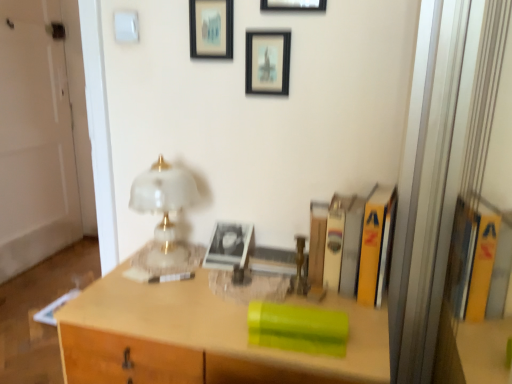
This screenshot has height=384, width=512. Find the location of `hardcover book at center, the second book positioned from the left`. hardcover book at center, the second book positioned from the left is located at coordinates (335, 240).

How much space does wooden picture frame at upper center, which is counted as the first picture frame, starting from the right, occupy horizontally?

The width of wooden picture frame at upper center, which is counted as the first picture frame, starting from the right, is 2.89 centimeters.

You are a GUI agent. You are given a task and a screenshot of the screen. Output one action in this format:
    pyautogui.click(x=<x>, y=<y>)
    Task: Click on the matte black picture frame at upper center, the 1th picture frame in the left-to-right sequence
    The height and width of the screenshot is (384, 512).
    Given the screenshot: What is the action you would take?
    pyautogui.click(x=211, y=29)

What do you see at coordinates (164, 208) in the screenshot? I see `matte glass table lamp at center` at bounding box center [164, 208].

The height and width of the screenshot is (384, 512). Find the location of `green plastic container at center, marked as the 3th book in a right-to-left arrangement`. green plastic container at center, marked as the 3th book in a right-to-left arrangement is located at coordinates (298, 328).

Can you confirm if hardcover book at center, the 2th book in the right-to-left sequence, is shorter than matte black picture frame at upper center, the 2th picture frame in the right-to-left sequence?

In fact, hardcover book at center, the 2th book in the right-to-left sequence, may be taller than matte black picture frame at upper center, the 2th picture frame in the right-to-left sequence.

Is hardcover book at center, the 2th book in the right-to-left sequence, aimed at matte black picture frame at upper center, the second picture frame viewed from the left?

No, hardcover book at center, the 2th book in the right-to-left sequence, is not aimed at matte black picture frame at upper center, the second picture frame viewed from the left.

Does hardcover book at center, the 2th book in the right-to-left sequence, have a smaller size compared to matte black picture frame at upper center, the second picture frame viewed from the left?

Actually, hardcover book at center, the 2th book in the right-to-left sequence, might be larger than matte black picture frame at upper center, the second picture frame viewed from the left.

Is point (338, 248) more distant than point (276, 91)?

That is False.

Considering the relative sizes of matte black picture frame at upper center, the 1th picture frame in the left-to-right sequence, and green plastic container at center, marked as the 3th book in a right-to-left arrangement, in the image provided, is matte black picture frame at upper center, the 1th picture frame in the left-to-right sequence, shorter than green plastic container at center, marked as the 3th book in a right-to-left arrangement,?

In fact, matte black picture frame at upper center, the 1th picture frame in the left-to-right sequence, may be taller than green plastic container at center, marked as the 3th book in a right-to-left arrangement.

Would you consider matte black picture frame at upper center, which is counted as the 3th picture frame, starting from the right, to be distant from green plastic container at center, marked as the 3th book in a right-to-left arrangement?

No, matte black picture frame at upper center, which is counted as the 3th picture frame, starting from the right, is in close proximity to green plastic container at center, marked as the 3th book in a right-to-left arrangement.

Is matte black picture frame at upper center, which is counted as the 3th picture frame, starting from the right, to the left or to the right of green plastic container at center, positioned as the first book in left-to-right order, in the image?

matte black picture frame at upper center, which is counted as the 3th picture frame, starting from the right, is positioned on green plastic container at center, positioned as the first book in left-to-right order,'s left side.

Who is shorter, wooden picture frame at upper center, which appears as the 3th picture frame when viewed from the left, or green plastic container at center?

Standing shorter between the two is wooden picture frame at upper center, which appears as the 3th picture frame when viewed from the left.

Which object is closer to the camera taking this photo, wooden picture frame at upper center, which is counted as the first picture frame, starting from the right, or green plastic container at center?

green plastic container at center is in front.

Locate an element on the screen. The height and width of the screenshot is (384, 512). picture frame that is the 2nd object to the right of the green plastic container at center, starting at the anchor is located at coordinates (294, 5).

Are wooden picture frame at upper center, which appears as the 3th picture frame when viewed from the left, and green plastic container at center beside each other?

wooden picture frame at upper center, which appears as the 3th picture frame when viewed from the left, and green plastic container at center are clearly separated.

Is point (246, 45) positioned before point (257, 303)?

No, (246, 45) is further to viewer.

Could you measure the distance between matte black picture frame at upper center, the second picture frame viewed from the left, and green plastic container at center, marked as the 3th book in a right-to-left arrangement?

matte black picture frame at upper center, the second picture frame viewed from the left, is 26.49 inches from green plastic container at center, marked as the 3th book in a right-to-left arrangement.

Considering the relative positions of matte black picture frame at upper center, the 2th picture frame in the right-to-left sequence, and green plastic container at center, marked as the 3th book in a right-to-left arrangement, in the image provided, is matte black picture frame at upper center, the 2th picture frame in the right-to-left sequence, in front of green plastic container at center, marked as the 3th book in a right-to-left arrangement,?

No.

Identify the location of the 2nd picture frame behind the green plastic container at center, positioned as the first book in left-to-right order. (267, 62).

Identify the location of desk below the matte glass table lamp at center (from a real-world perspective). (199, 338).

Does green plastic container at center have a greater width compared to matte glass table lamp at center?

Yes.

From the image's perspective, which one is positioned lower, green plastic container at center or matte glass table lamp at center?

green plastic container at center.

Can yellow hardcover book at right, positioned as the first book in right-to-left order, be found inside wooden picture frame at upper center, which appears as the 3th picture frame when viewed from the left?

Actually, yellow hardcover book at right, positioned as the first book in right-to-left order, is outside wooden picture frame at upper center, which appears as the 3th picture frame when viewed from the left.

Considering their positions, is wooden picture frame at upper center, which appears as the 3th picture frame when viewed from the left, located in front of or behind yellow hardcover book at right, which is counted as the 3th book, starting from the left?

wooden picture frame at upper center, which appears as the 3th picture frame when viewed from the left, is behind yellow hardcover book at right, which is counted as the 3th book, starting from the left.

How many degrees apart are the facing directions of wooden picture frame at upper center, which is counted as the first picture frame, starting from the right, and yellow hardcover book at right, which is counted as the 3th book, starting from the left?

wooden picture frame at upper center, which is counted as the first picture frame, starting from the right, and yellow hardcover book at right, which is counted as the 3th book, starting from the left, are facing 7.82 degrees away from each other.

Is wooden picture frame at upper center, which appears as the 3th picture frame when viewed from the left, not near yellow hardcover book at right, which is counted as the 3th book, starting from the left?

No, there isn't a large distance between wooden picture frame at upper center, which appears as the 3th picture frame when viewed from the left, and yellow hardcover book at right, which is counted as the 3th book, starting from the left.

This screenshot has height=384, width=512. I want to click on book that is the 1st one when counting forward from the matte black picture frame at upper center, the 2th picture frame in the right-to-left sequence, so click(335, 240).

From a real-world perspective, is matte black picture frame at upper center, the second picture frame viewed from the left, on hardcover book at center, the 2th book in the right-to-left sequence?

Correct, in the physical world, matte black picture frame at upper center, the second picture frame viewed from the left, is higher than hardcover book at center, the 2th book in the right-to-left sequence.

How many degrees apart are the facing directions of matte black picture frame at upper center, the 2th picture frame in the right-to-left sequence, and hardcover book at center, the second book positioned from the left?

The angular difference between matte black picture frame at upper center, the 2th picture frame in the right-to-left sequence, and hardcover book at center, the second book positioned from the left, is 3.73 degrees.

In the scene shown: Is matte black picture frame at upper center, the second picture frame viewed from the left, not close to hardcover book at center, the second book positioned from the left?

No, matte black picture frame at upper center, the second picture frame viewed from the left, is not far from hardcover book at center, the second book positioned from the left.

There is a hardcover book at center, the second book positioned from the left. What are the coordinates of `the 1st picture frame above it (from the image's perspective)` in the screenshot? It's located at (267, 62).

The image size is (512, 384). Identify the location of the 2nd picture frame to the left of the green plastic container at center, positioned as the first book in left-to-right order, starting your count from the anchor. (211, 29).

Which object lies nearer to the anchor point green plastic container at center, wooden picture frame at upper center, which appears as the 3th picture frame when viewed from the left, or matte black picture frame at upper center, the second picture frame viewed from the left?

Based on the image, matte black picture frame at upper center, the second picture frame viewed from the left, appears to be nearer to green plastic container at center.

When comparing their distances from hardcover book at center, the second book positioned from the left, does matte black picture frame at upper center, the second picture frame viewed from the left, or matte glass table lamp at center seem closer?

matte black picture frame at upper center, the second picture frame viewed from the left, is positioned closer to the anchor hardcover book at center, the second book positioned from the left.

Estimate the real-world distances between objects in this image. Which object is closer to white glossy door at left, matte black picture frame at upper center, the 2th picture frame in the right-to-left sequence, or wooden picture frame at upper center, which appears as the 3th picture frame when viewed from the left?

matte black picture frame at upper center, the 2th picture frame in the right-to-left sequence, is positioned closer to the anchor white glossy door at left.

Looking at the image, which one is located further to matte glass table lamp at center, green plastic container at center, marked as the 3th book in a right-to-left arrangement, or yellow hardcover book at right, which is counted as the 3th book, starting from the left?

The object further to matte glass table lamp at center is yellow hardcover book at right, which is counted as the 3th book, starting from the left.

When comparing their distances from green plastic container at center, does hardcover book at center, the second book positioned from the left, or matte black picture frame at upper center, the 1th picture frame in the left-to-right sequence, seem further?

The object further to green plastic container at center is matte black picture frame at upper center, the 1th picture frame in the left-to-right sequence.

When comparing their distances from matte black picture frame at upper center, the 2th picture frame in the right-to-left sequence, does wooden picture frame at upper center, which appears as the 3th picture frame when viewed from the left, or yellow hardcover book at right, which is counted as the 3th book, starting from the left, seem closer?

The object closer to matte black picture frame at upper center, the 2th picture frame in the right-to-left sequence, is wooden picture frame at upper center, which appears as the 3th picture frame when viewed from the left.

Considering their positions, is green plastic container at center positioned further to yellow hardcover book at right, which is counted as the 3th book, starting from the left, than matte black picture frame at upper center, the second picture frame viewed from the left?

Based on the image, matte black picture frame at upper center, the second picture frame viewed from the left, appears to be further to yellow hardcover book at right, which is counted as the 3th book, starting from the left.

Consider the image. From the image, which object appears to be nearer to green plastic container at center, positioned as the first book in left-to-right order, green plastic container at center or hardcover book at center, the 2th book in the right-to-left sequence?

Among the two, green plastic container at center is located nearer to green plastic container at center, positioned as the first book in left-to-right order.

The height and width of the screenshot is (384, 512). In order to click on table lamp situated between white glossy door at left and matte black picture frame at upper center, the 2th picture frame in the right-to-left sequence, from left to right in this screenshot , I will do `click(164, 208)`.

This screenshot has width=512, height=384. What are the coordinates of `table lamp between matte black picture frame at upper center, the 2th picture frame in the right-to-left sequence, and green plastic container at center in the up-down direction` in the screenshot? It's located at (164, 208).

The height and width of the screenshot is (384, 512). I want to click on book between matte black picture frame at upper center, which is counted as the 3th picture frame, starting from the right, and yellow hardcover book at right, which is counted as the 3th book, starting from the left, in the vertical direction, so click(335, 240).

Find the location of a particular element. Image resolution: width=512 pixels, height=384 pixels. table lamp between wooden picture frame at upper center, which appears as the 3th picture frame when viewed from the left, and green plastic container at center vertically is located at coordinates (164, 208).